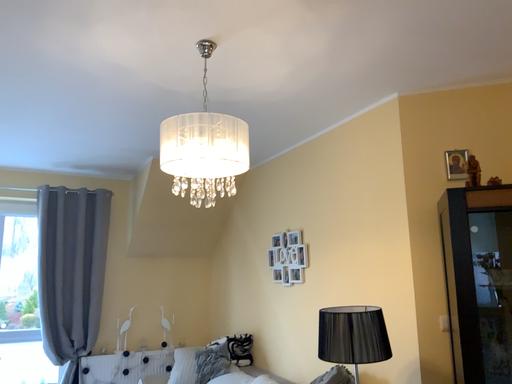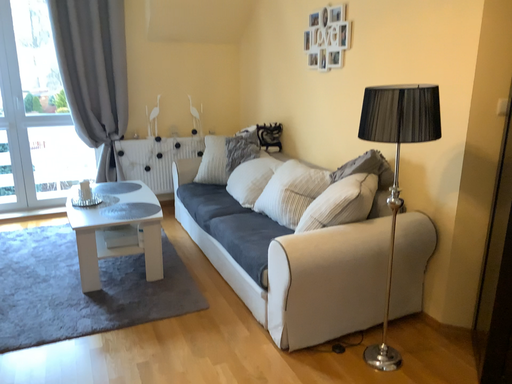
Question: Which way did the camera rotate in the video?

Choices:
 (A) rotated downward
 (B) rotated upward

Answer: (A)